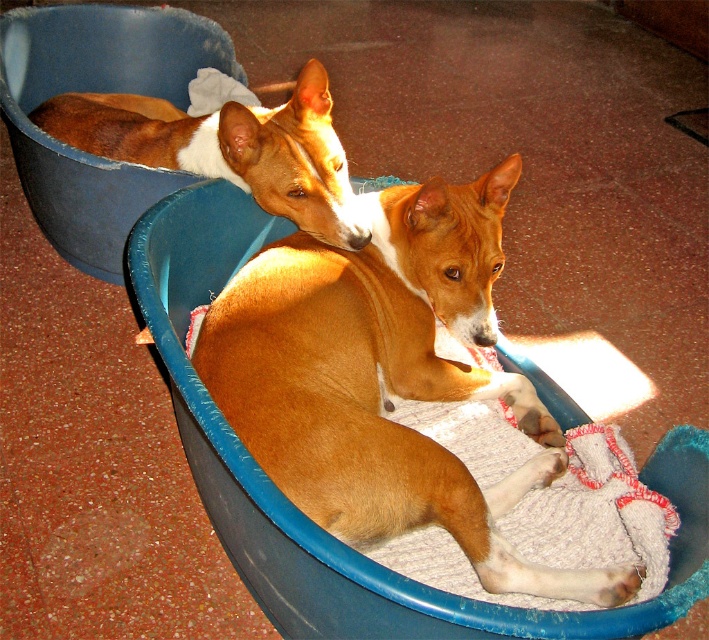
Question: Which point is farther from the camera taking this photo?

Choices:
 (A) (52, 132)
 (B) (291, 246)

Answer: (A)

Question: Considering the relative positions of brown furry dog at center and brown smooth dog at upper left in the image provided, where is brown furry dog at center located with respect to brown smooth dog at upper left?

Choices:
 (A) below
 (B) above

Answer: (A)

Question: Which of the following is the farthest from the observer?

Choices:
 (A) brown furry dog at center
 (B) brown smooth dog at upper left

Answer: (B)

Question: Can you confirm if brown furry dog at center is positioned to the right of brown smooth dog at upper left?

Choices:
 (A) yes
 (B) no

Answer: (A)

Question: Where is brown furry dog at center located in relation to brown smooth dog at upper left in the image?

Choices:
 (A) right
 (B) left

Answer: (A)